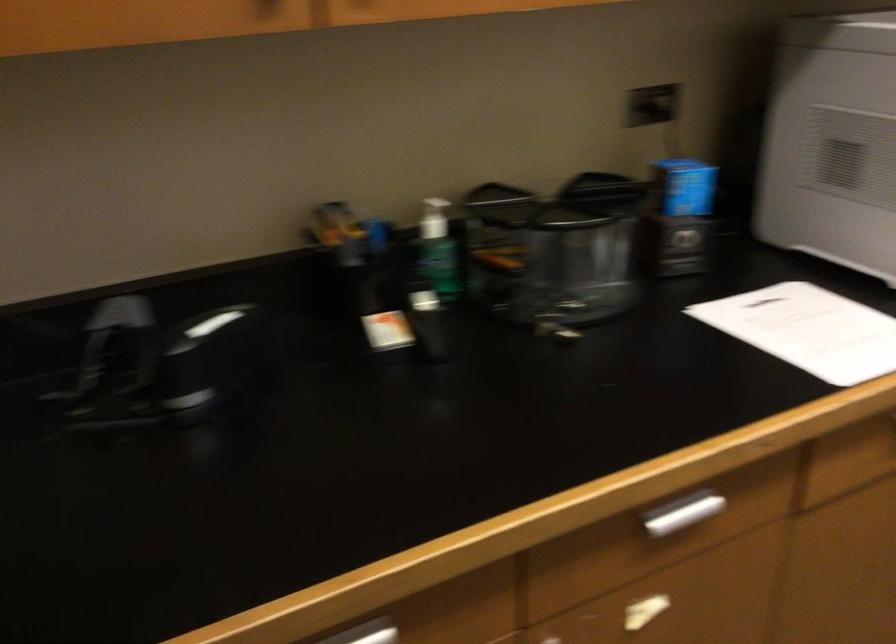
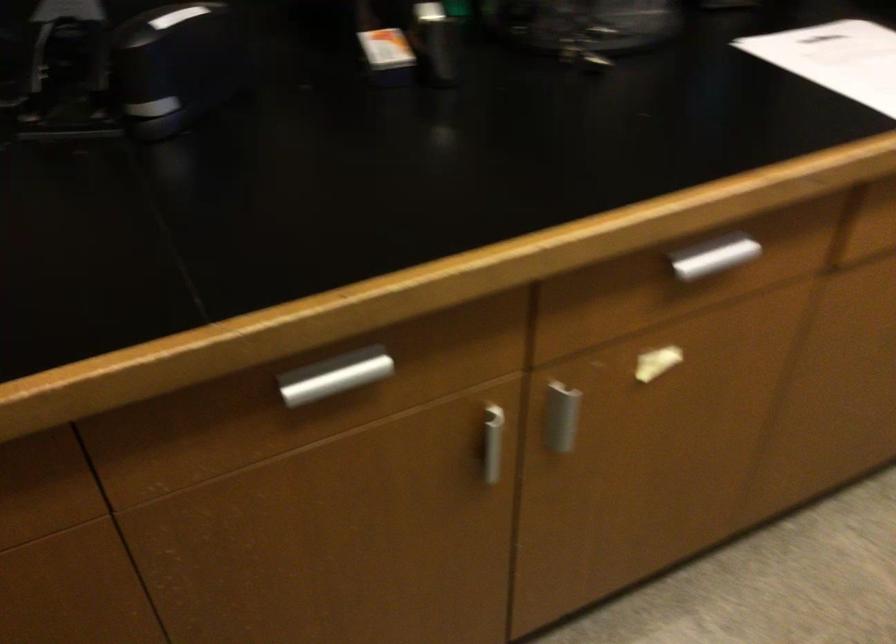
The point at (776, 321) is marked in the first image. Where is the corresponding point in the second image?

(836, 59)